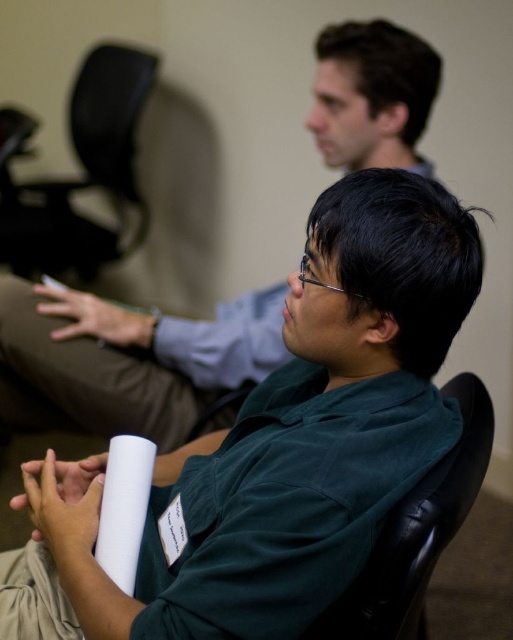
You are a photographer setting up for a group photo in the conference room. You have a camera with a focal length that requires subjects to be at least 2 meters away. You see the black leather swivel chair at left. Is the camera positioned far enough from the chair to take a clear photo?

The black leather swivel chair at left and camera are 2.36 meters apart, which is more than the required 2 meters. Therefore, the camera is positioned far enough to take a clear photo.

You are a security guard in the conference room and need to locate the green fabric shirt at center and the black leather swivel chair at left. Based on their positions, which object is closer to the entrance door located on the far left wall?

The black leather swivel chair at left is closer to the entrance door located on the far left wall because it is positioned to the left of the green fabric shirt at center.

You are standing in the conference room and want to place a 24 inch wide poster on the wall. The poster must be placed exactly at point (356, 355). Will the poster fit without overlapping any objects in the scene?

The distance between the viewer and point (356, 355) is 30.94 inches. Since the poster is 24 inches wide, it will fit as long as there is enough space horizontally at that point. However, the scene description does not mention any objects obstructing that area, so it should fit without overlapping.